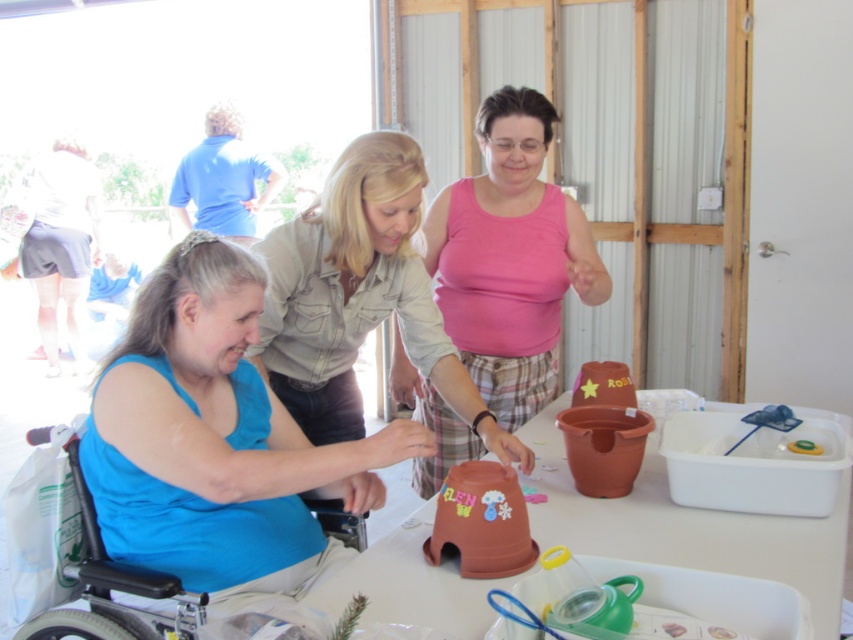
Is point (428, 525) more distant than point (340, 516)?

No, (428, 525) is in front of (340, 516).

Can you confirm if terracotta clay pot at center is bigger than blue fabric wheelchair at lower left?

Yes, terracotta clay pot at center is bigger than blue fabric wheelchair at lower left.

Which is in front, point (811, 573) or point (190, 627)?

Point (811, 573)

You are a GUI agent. You are given a task and a screenshot of the screen. Output one action in this format:
    pyautogui.click(x=<x>, y=<y>)
    Task: Click on the terracotta clay pot at center
    
    Given the screenshot: What is the action you would take?
    pyautogui.click(x=693, y=524)

Does pink matte tank top at center have a greater width compared to terracotta clay pot at center?

No.

Based on the photo, is pink matte tank top at center behind terracotta clay pot at center?

Yes, it is.

I want to click on pink matte tank top at center, so click(509, 259).

This screenshot has height=640, width=853. In order to click on pink matte tank top at center in this screenshot , I will do `click(509, 259)`.

This screenshot has width=853, height=640. Find the location of `pink matte tank top at center`. pink matte tank top at center is located at coordinates (509, 259).

Between pink matte tank top at center and blue fabric wheelchair at lower left, which one is positioned lower?

blue fabric wheelchair at lower left is lower down.

The height and width of the screenshot is (640, 853). Identify the location of pink matte tank top at center. (509, 259).